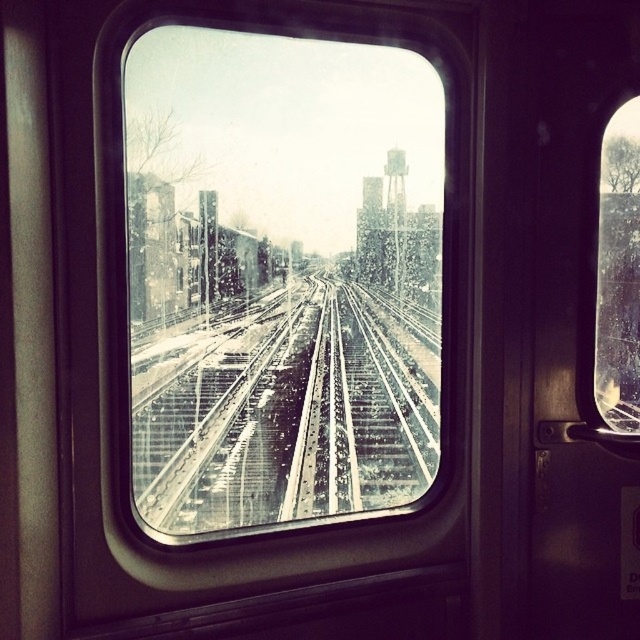
Question: Where is metallic glass train window at center located in relation to transparent glass window at right in the image?

Choices:
 (A) right
 (B) left

Answer: (B)

Question: Which point is farther to the camera?

Choices:
 (A) transparent glass window at right
 (B) metallic glass train window at center
 (C) metal/textured tracks at center

Answer: (A)

Question: Which object is closer to the camera taking this photo?

Choices:
 (A) metallic glass train window at center
 (B) transparent glass window at right

Answer: (A)

Question: Which point appears farthest from the camera in this image?

Choices:
 (A) (323, 509)
 (B) (320, 196)

Answer: (A)

Question: Does metal/textured tracks at center come behind transparent glass window at right?

Choices:
 (A) no
 (B) yes

Answer: (A)

Question: Does metallic glass train window at center appear over transparent glass window at right?

Choices:
 (A) yes
 (B) no

Answer: (B)